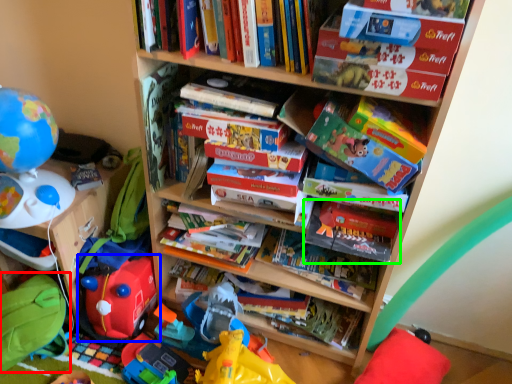
Question: Which object is the farthest from bean bag chair (highlighted by a red box)? Choose among these: toy (highlighted by a blue box) or paperback book (highlighted by a green box).

Choices:
 (A) toy
 (B) paperback book

Answer: (B)